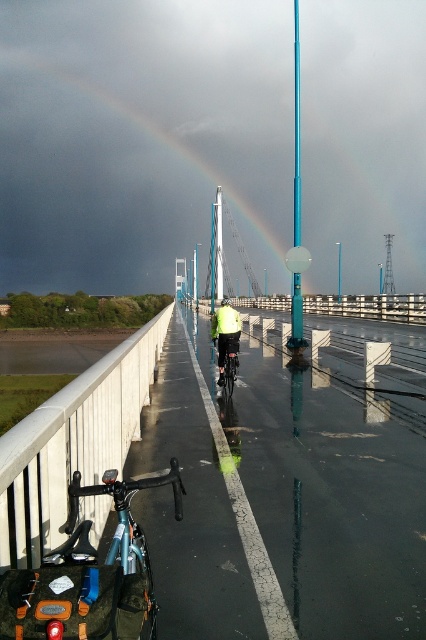
You are a photographer standing on the bridge and want to capture both the teal glossy pole at center and the high visibility yellow jacket at center in a single frame. Which object should you focus on first to ensure both are in the frame?

The teal glossy pole at center has a larger size compared to the high visibility yellow jacket at center, so you should focus on the teal glossy pole at center first to ensure both are in the frame.

You are standing at the center of the bridge and want to locate the shiny metallic bicycle at lower left. According to the coordinates provided, in which direction should you look to find it?

The shiny metallic bicycle at lower left is located at coordinates point [89,573], which is towards the lower left direction from your current position at the center of the bridge.